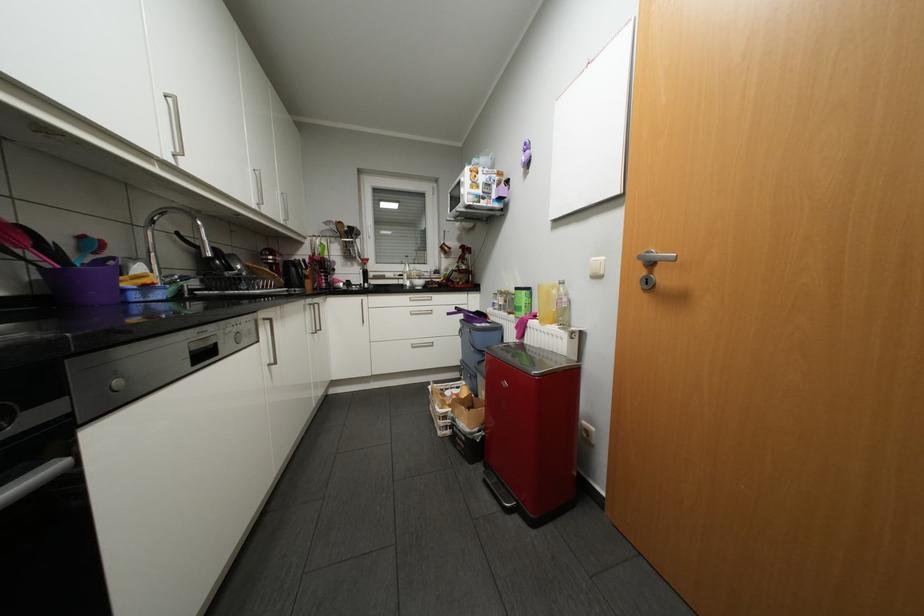
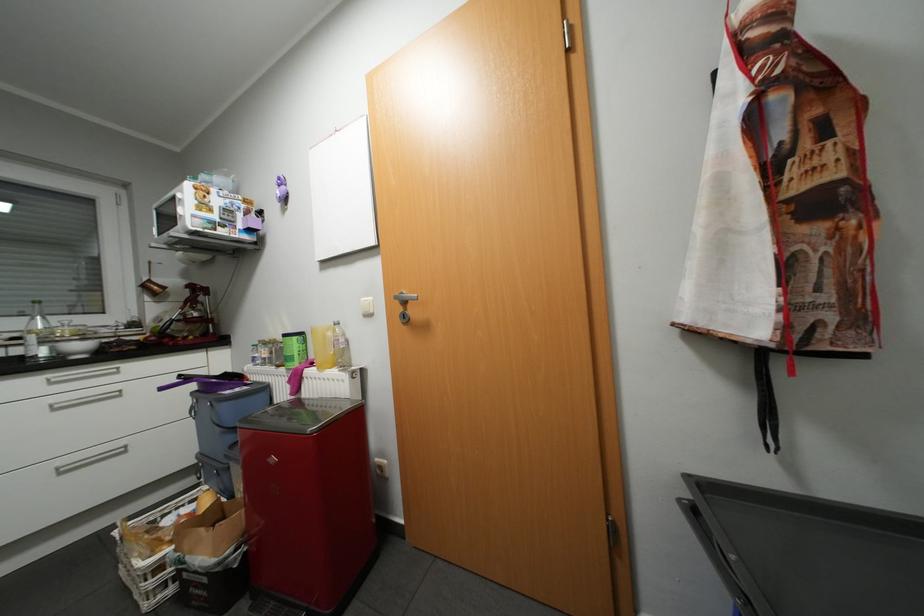
In the second image, find the point that corresponds to (x=419, y=313) in the first image.

(64, 408)